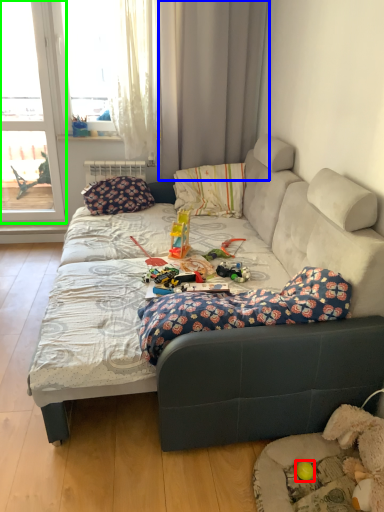
Question: Which is nearer to the toy (highlighted by a red box)? curtain (highlighted by a blue box) or window (highlighted by a green box).

Choices:
 (A) curtain
 (B) window

Answer: (A)